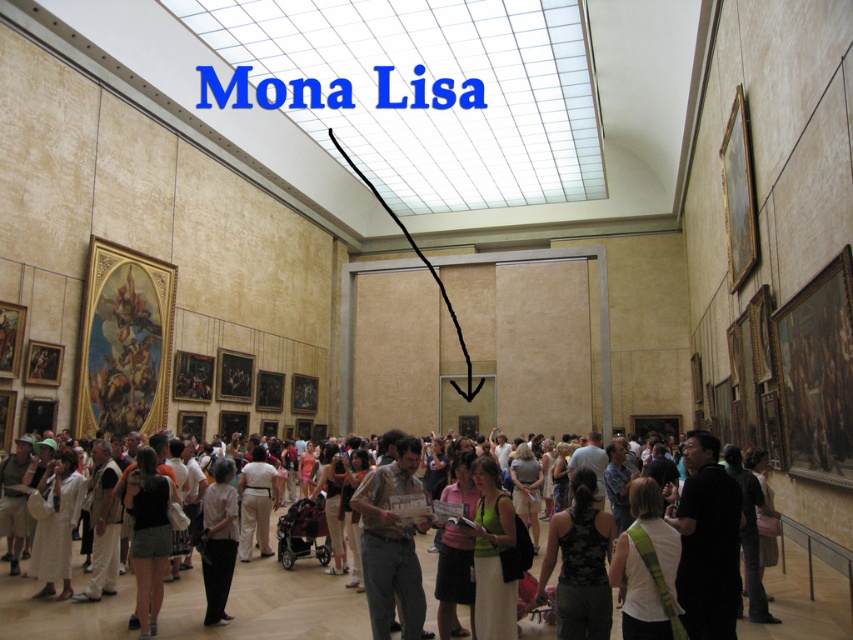
In the scene shown: Does pink fabric dress at center come in front of white cotton shirt at center?

Yes, pink fabric dress at center is closer to the viewer.

Between pink fabric dress at center and white cotton shirt at center, which one appears on the left side from the viewer's perspective?

white cotton shirt at center

Between point (469, 620) and point (231, 467), which one is positioned in front?

Point (469, 620) is in front.

Locate an element on the screen. This screenshot has height=640, width=853. pink fabric dress at center is located at coordinates (454, 579).

Does green fabric dress at center have a larger size compared to matte black stroller at center?

No.

Is green fabric dress at center thinner than matte black stroller at center?

Correct, green fabric dress at center's width is less than matte black stroller at center's.

Does point (514, 525) lie behind point (339, 545)?

No, it is not.

You are a GUI agent. You are given a task and a screenshot of the screen. Output one action in this format:
    pyautogui.click(x=<x>, y=<y>)
    Task: Click on the green fabric dress at center
    
    Given the screenshot: What is the action you would take?
    pyautogui.click(x=492, y=556)

Consider the image. Is white cotton dress at lower left taller than pink fabric dress at center?

Yes.

Measure the distance between point (x=62, y=566) and camera.

Point (x=62, y=566) and camera are 14.08 meters apart.

Where is `white cotton dress at lower left`? The width and height of the screenshot is (853, 640). white cotton dress at lower left is located at coordinates pyautogui.click(x=57, y=525).